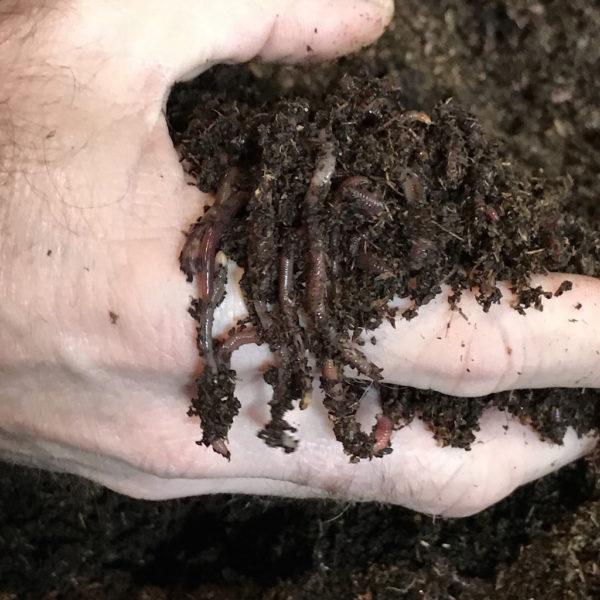
This screenshot has height=600, width=600. I want to click on corner, so click(582, 591), click(10, 586), click(15, 32), click(579, 14).